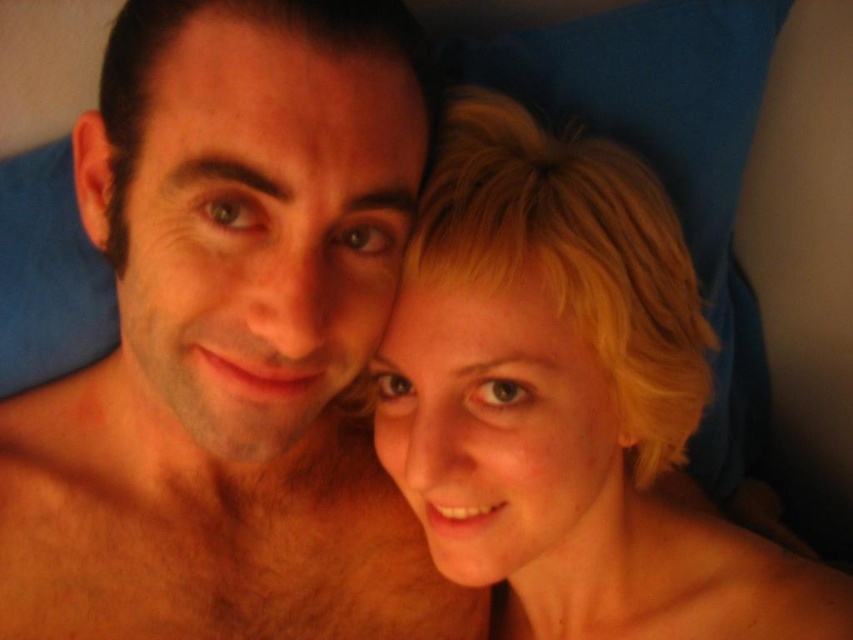
Based on the scene description, can you determine if the brown hair at left is positioned higher than the hairy skin at lower left?

Yes, the brown hair at left is much taller than the hairy skin at lower left according to the description.

Based on the scene description, is the brown hair at left covering part of the hairy skin at lower left?

Yes, the brown hair at left is positioned over the hairy skin at lower left, so it is covering part of it.

In the scene shown: You are a photographer trying to capture a closeup shot of the brown hair at left. You have a camera with a minimum focusing distance of 16 inches. Can you achieve the closeup without moving the camera or the subject?

The brown hair at left is 16.10 inches away from the camera, which is just slightly beyond the minimum focusing distance of 16 inches. Therefore, the camera cannot achieve the closeup without moving the camera or the subject closer.